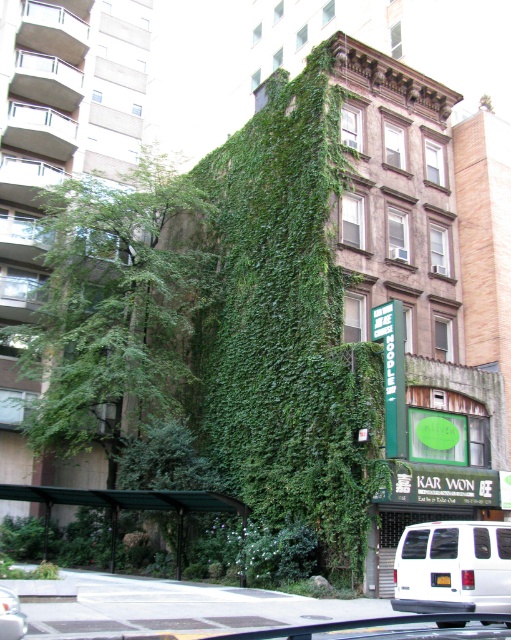
This screenshot has height=640, width=511. What do you see at coordinates (453, 566) in the screenshot? I see `white matte van at lower right` at bounding box center [453, 566].

Between point (413, 525) and point (1, 595), which one is positioned behind?

The point (413, 525) is behind.

The image size is (511, 640). What are the coordinates of `white matte van at lower right` in the screenshot? It's located at (453, 566).

Is point (243, 195) in front of point (466, 522)?

No, (243, 195) is further to viewer.

Looking at this image, can you confirm if green leafy ivy at center is smaller than white matte van at lower right?

No.

Is point (249, 486) less distant than point (485, 529)?

That is False.

Where is `green leafy ivy at center`? This screenshot has height=640, width=511. green leafy ivy at center is located at coordinates (286, 324).

Describe the element at coordinates (286, 324) in the screenshot. I see `green leafy ivy at center` at that location.

Identify the location of green leafy ivy at center. (286, 324).